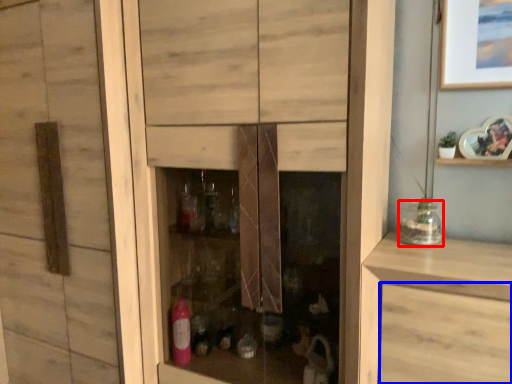
Question: Among these objects, which one is nearest to the camera, glass jar (highlighted by a red box) or drawer (highlighted by a blue box)?

Choices:
 (A) glass jar
 (B) drawer

Answer: (B)